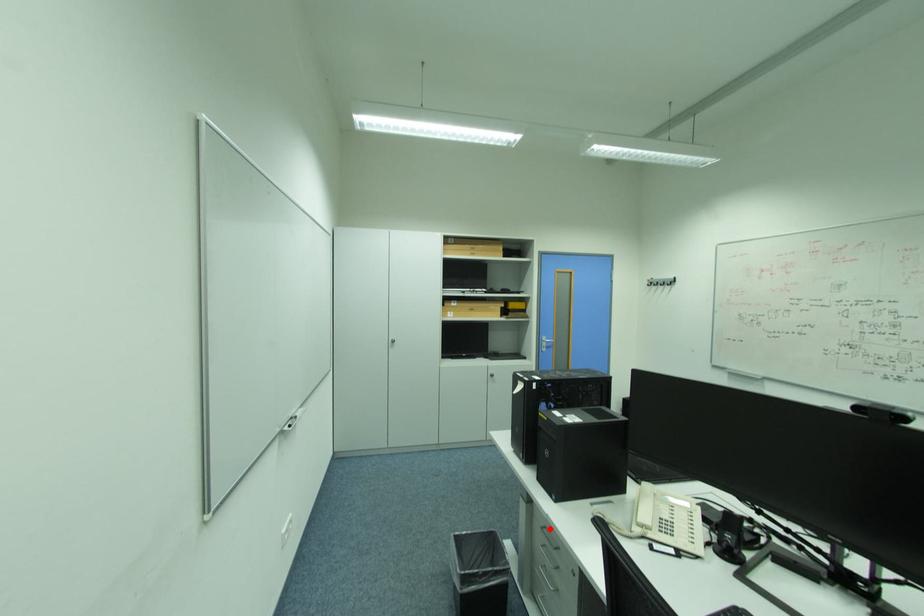
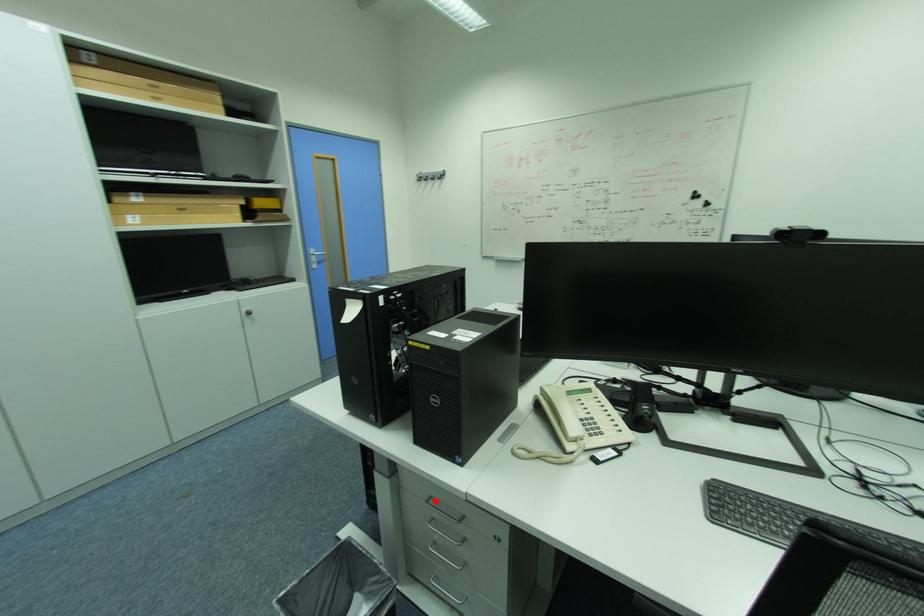
I am providing you with two images of the same scene from different viewpoints. A red point is marked on the first image and another point is marked on the second image. Are the points marked in image1 and image2 representing the same 3D position?

Yes